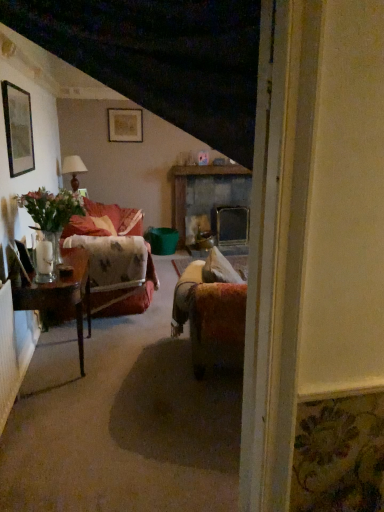
Question: Considering the relative sizes of matte brown lamp at upper left and green matte picture frame at upper left, which appears as the 2th picture frame when viewed from the right, in the image provided, is matte brown lamp at upper left thinner than green matte picture frame at upper left, which appears as the 2th picture frame when viewed from the right,?

Choices:
 (A) no
 (B) yes

Answer: (A)

Question: From a real-world perspective, is matte brown lamp at upper left on green matte picture frame at upper left, which is counted as the 2th picture frame, starting from the top?

Choices:
 (A) no
 (B) yes

Answer: (A)

Question: Does matte brown lamp at upper left have a greater width compared to green matte picture frame at upper left, which is the first picture frame in left-to-right order?

Choices:
 (A) no
 (B) yes

Answer: (B)

Question: From the image's perspective, is matte brown lamp at upper left on top of green matte picture frame at upper left, which is the first picture frame in left-to-right order?

Choices:
 (A) yes
 (B) no

Answer: (A)

Question: Is matte brown lamp at upper left in contact with green matte picture frame at upper left, acting as the 1th picture frame starting from the front?

Choices:
 (A) yes
 (B) no

Answer: (B)

Question: In terms of width, does velvet floral couch at left look wider or thinner when compared to matte brown lamp at upper left?

Choices:
 (A) wide
 (B) thin

Answer: (A)

Question: From a real-world perspective, is velvet floral couch at left physically located above or below matte brown lamp at upper left?

Choices:
 (A) above
 (B) below

Answer: (B)

Question: In the image, is velvet floral couch at left positioned in front of or behind matte brown lamp at upper left?

Choices:
 (A) behind
 (B) front

Answer: (B)

Question: Does point (109, 294) appear closer or farther from the camera than point (72, 158)?

Choices:
 (A) closer
 (B) farther

Answer: (A)

Question: Is matte brown lamp at upper left to the left or to the right of rustic stone fireplace at center in the image?

Choices:
 (A) right
 (B) left

Answer: (B)

Question: From a real-world perspective, is matte brown lamp at upper left positioned above or below rustic stone fireplace at center?

Choices:
 (A) below
 (B) above

Answer: (B)

Question: Is matte brown lamp at upper left taller or shorter than rustic stone fireplace at center?

Choices:
 (A) short
 (B) tall

Answer: (A)

Question: Considering the positions of matte brown lamp at upper left and rustic stone fireplace at center in the image, is matte brown lamp at upper left bigger or smaller than rustic stone fireplace at center?

Choices:
 (A) big
 (B) small

Answer: (B)

Question: From a real-world perspective, is matte gold picture frame at upper center, the second picture frame positioned from the left, positioned above or below matte brown lamp at upper left?

Choices:
 (A) above
 (B) below

Answer: (A)

Question: From the image's perspective, is matte gold picture frame at upper center, placed as the 1th picture frame when sorted from top to bottom, above or below matte brown lamp at upper left?

Choices:
 (A) above
 (B) below

Answer: (A)